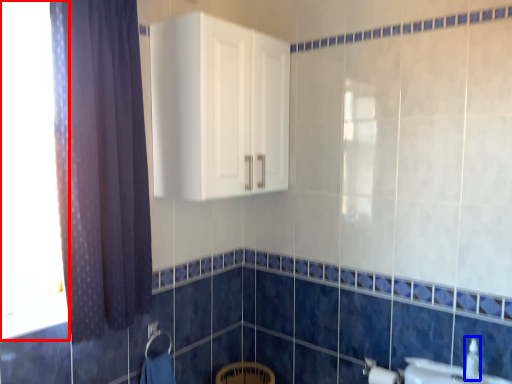
Question: Which of the following is the closest to the observer, window (highlighted by a red box) or plumbing fixture (highlighted by a blue box)?

Choices:
 (A) window
 (B) plumbing fixture

Answer: (A)